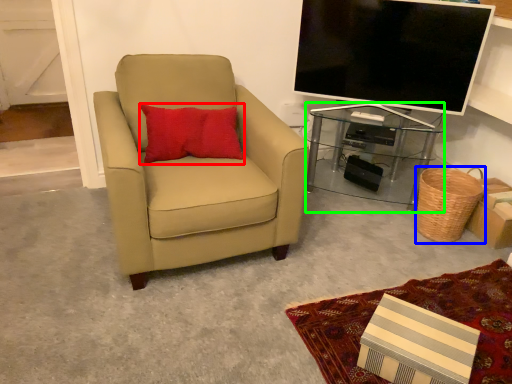
Question: Which object is the farthest from pillow (highlighted by a red box)? Choose among these: basket (highlighted by a blue box) or desk (highlighted by a green box).

Choices:
 (A) basket
 (B) desk

Answer: (A)